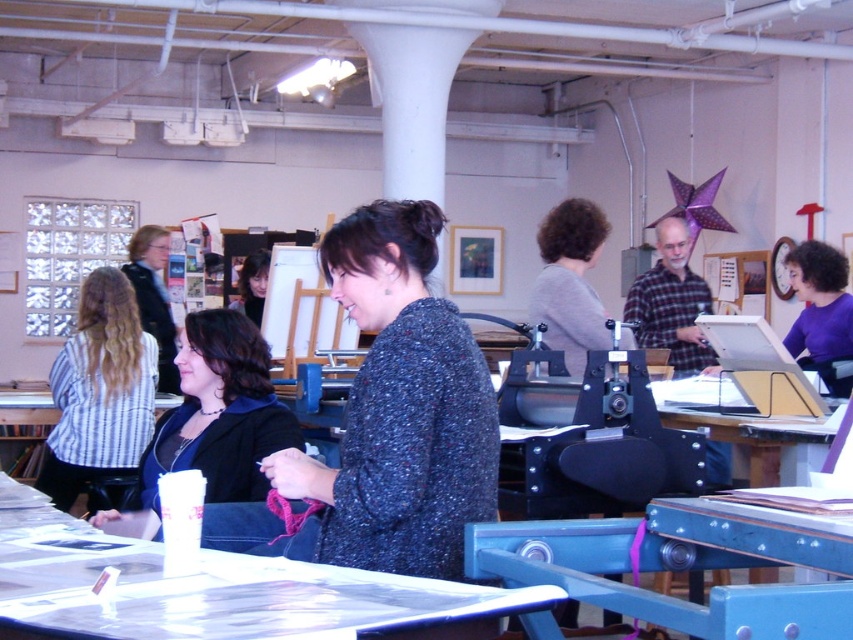
Is white glossy table at lower center to the right of matte black jacket at center from the viewer's perspective?

No, white glossy table at lower center is not to the right of matte black jacket at center.

Is white glossy table at lower center bigger than matte black jacket at center?

Yes.

Between point (33, 492) and point (194, 433), which one is positioned in front?

Point (194, 433) is in front.

Where is `white glossy table at lower center`? white glossy table at lower center is located at coordinates (213, 589).

Does gray sweater at center have a greater width compared to matte black hair at center?

Incorrect, gray sweater at center's width does not surpass matte black hair at center's.

Is point (592, 259) closer to camera compared to point (260, 284)?

Yes, point (592, 259) is closer to viewer.

Locate an element on the screen. This screenshot has height=640, width=853. gray sweater at center is located at coordinates (570, 282).

Between point (432, 429) and point (228, 380), which one is positioned behind?

Positioned behind is point (228, 380).

Who is higher up, speckled wool sweater at center or matte black jacket at center?

speckled wool sweater at center

Locate an element on the screen. Image resolution: width=853 pixels, height=640 pixels. speckled wool sweater at center is located at coordinates (399, 406).

What are the coordinates of `speckled wool sweater at center` in the screenshot? It's located at (399, 406).